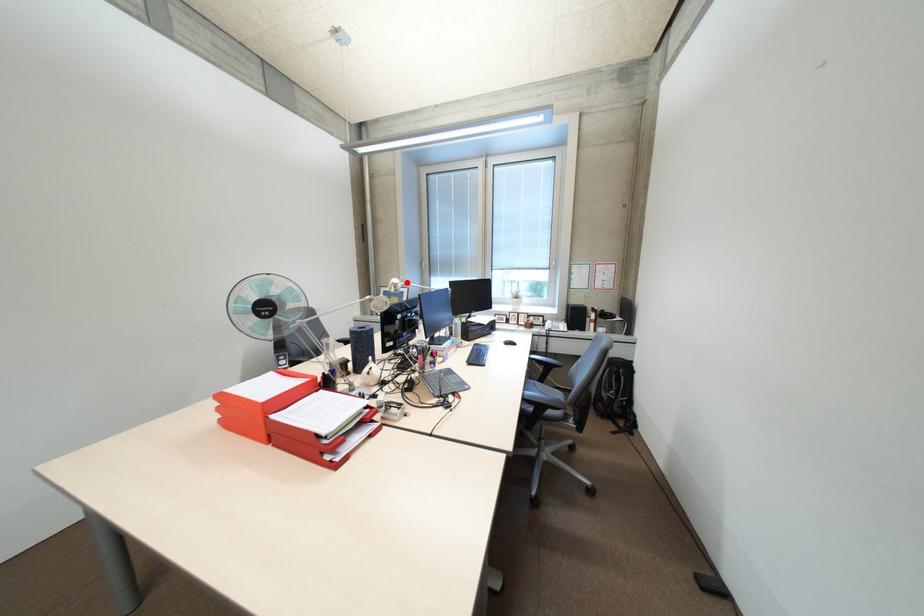
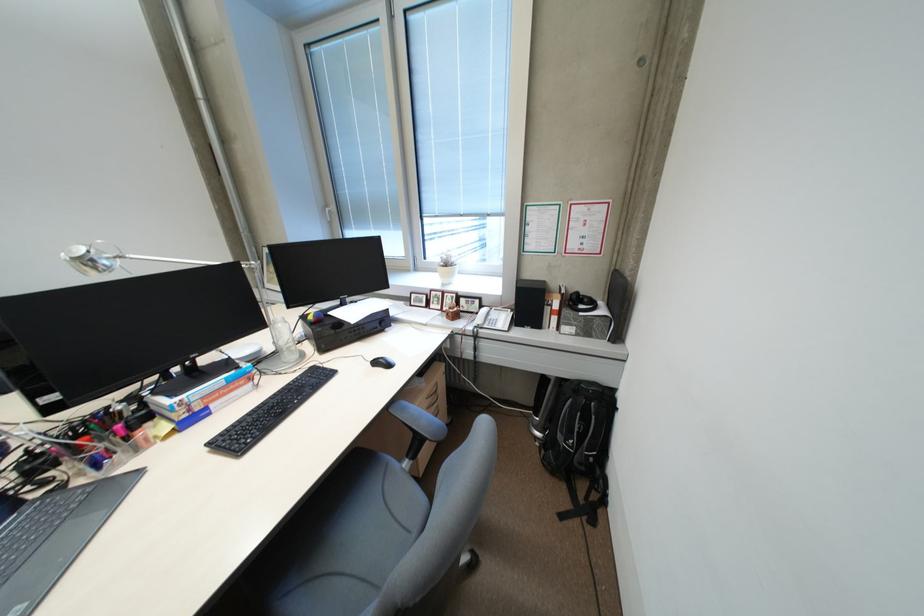
Find the pixel in the second image that matches the highlighted location in the first image.

(90, 257)